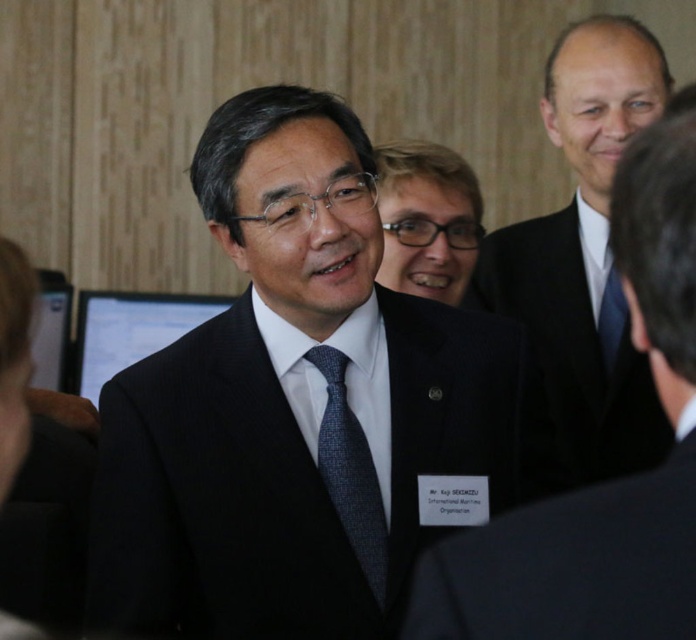
Between satin black suit at upper right and blue silk tie at right, which one appears on the left side from the viewer's perspective?

Positioned to the left is satin black suit at upper right.

Locate an element on the screen. The height and width of the screenshot is (640, 696). satin black suit at upper right is located at coordinates (580, 262).

Where is `satin black suit at upper right`? This screenshot has width=696, height=640. satin black suit at upper right is located at coordinates (580, 262).

Can you confirm if matte black monitor at center is positioned above blue silk tie at right?

Correct, matte black monitor at center is located above blue silk tie at right.

Does matte black monitor at center have a larger size compared to blue silk tie at right?

Yes, matte black monitor at center is bigger than blue silk tie at right.

Is point (182, 308) in front of point (617, 340)?

No, it is not.

Locate an element on the screen. The width and height of the screenshot is (696, 640). matte black monitor at center is located at coordinates (132, 330).

Can you confirm if satin black suit at upper right is thinner than black matte suit at center?

In fact, satin black suit at upper right might be wider than black matte suit at center.

Which of these two, satin black suit at upper right or black matte suit at center, stands shorter?

With less height is black matte suit at center.

Is point (656, 416) more distant than point (532, 515)?

Yes, it is.

Locate an element on the screen. satin black suit at upper right is located at coordinates (580, 262).